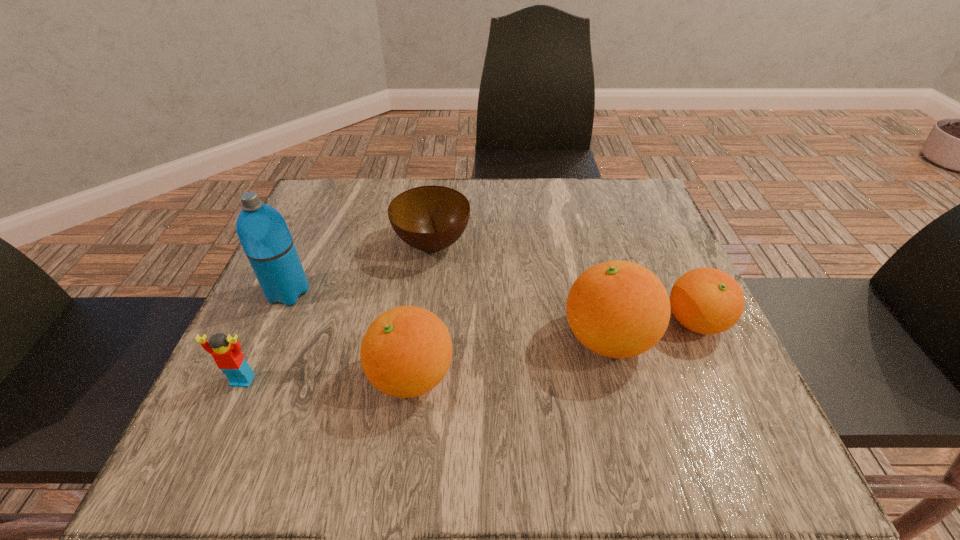
Find the location of a particular element. The height and width of the screenshot is (540, 960). free spot that satisfies the following two spatial constraints: 1. on the front side of the third tallest object; 2. on the left side of the thermos bottle is located at coordinates (252, 376).